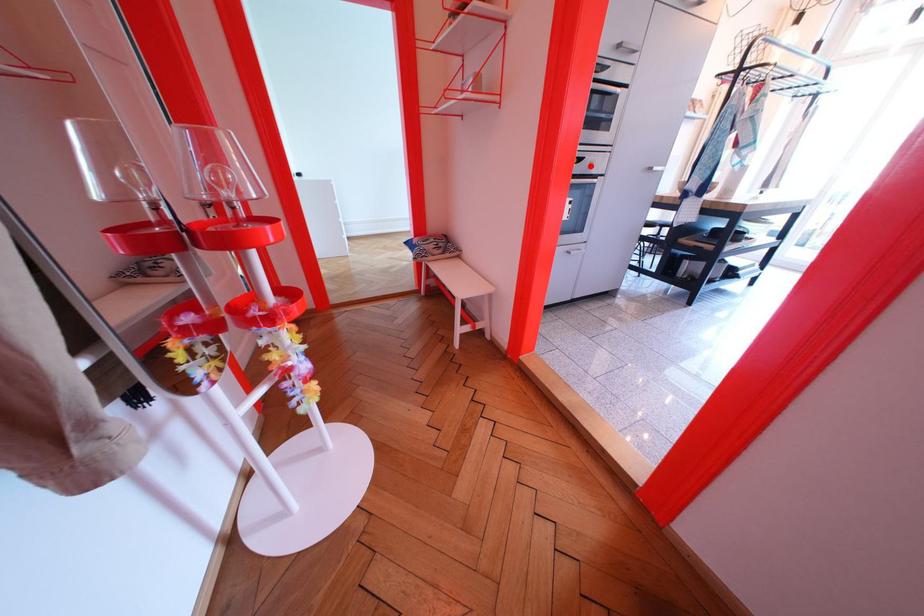
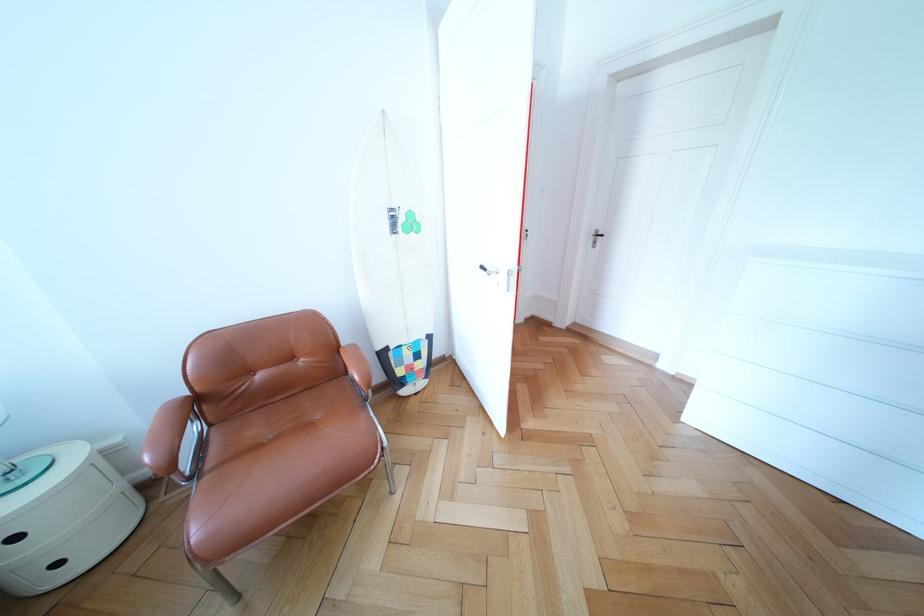
Question: I am providing you with two images of the same scene from different viewpoints. A red point is marked on the first image. At the location where the point appears in image 1, is it still visible in image 2?

Choices:
 (A) Yes
 (B) No

Answer: (B)